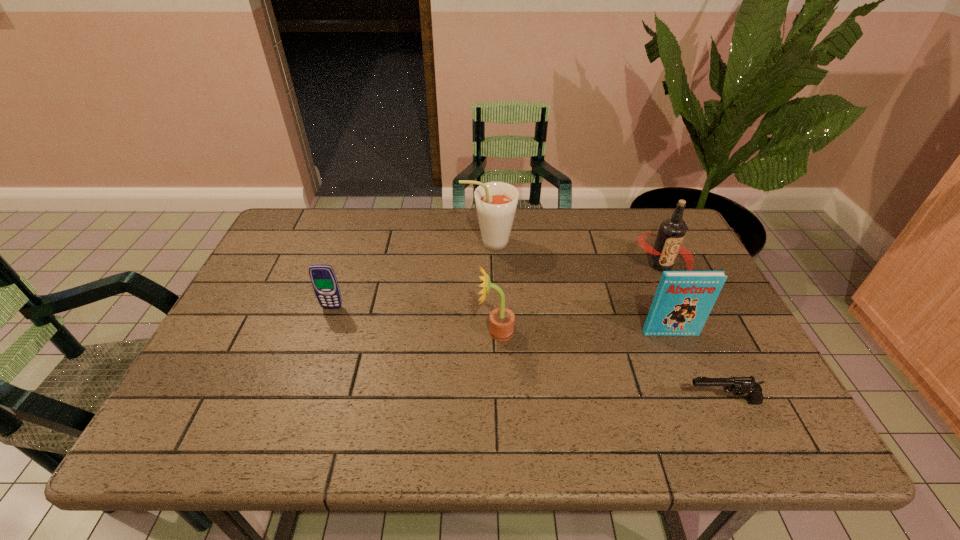
Where is `root beer that is at the right edge`? The width and height of the screenshot is (960, 540). root beer that is at the right edge is located at coordinates (668, 243).

This screenshot has height=540, width=960. Find the location of `book that is at the right edge`. book that is at the right edge is located at coordinates (683, 300).

This screenshot has width=960, height=540. I want to click on gun that is at the right edge, so click(x=737, y=385).

Where is `object that is positioned at the far right corner`? object that is positioned at the far right corner is located at coordinates (668, 243).

In the image, there is a desktop. Identify the location of vacant space at the far edge. (388, 226).

Identify the location of vacant area at the near edge. The height and width of the screenshot is (540, 960). (507, 417).

Where is `vacant region at the left edge of the desktop`? vacant region at the left edge of the desktop is located at coordinates click(x=267, y=328).

In the image, there is a desktop. What are the coordinates of `vacant region at the right edge` in the screenshot? It's located at (720, 357).

In the image, there is a desktop. Where is `free space at the far left corner`? This screenshot has width=960, height=540. free space at the far left corner is located at coordinates (300, 228).

Locate an element on the screen. free region at the far right corner of the desktop is located at coordinates (647, 213).